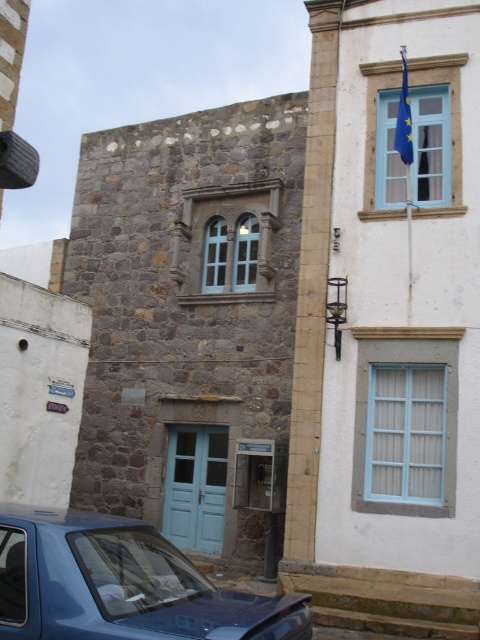
Question: Does metallic blue car at lower left have a lesser width compared to blue fabric flag at upper right?

Choices:
 (A) yes
 (B) no

Answer: (B)

Question: Which object is farther from the camera taking this photo?

Choices:
 (A) blue fabric flag at upper right
 (B) metallic blue car at lower left

Answer: (A)

Question: Is metallic blue car at lower left bigger than blue fabric flag at upper right?

Choices:
 (A) yes
 (B) no

Answer: (A)

Question: Does metallic blue car at lower left come in front of blue fabric flag at upper right?

Choices:
 (A) yes
 (B) no

Answer: (A)

Question: Which object is farther from the camera taking this photo?

Choices:
 (A) metallic blue car at lower left
 (B) blue fabric flag at upper right

Answer: (B)

Question: Which of the following is the farthest from the observer?

Choices:
 (A) (46, 608)
 (B) (405, 148)

Answer: (B)